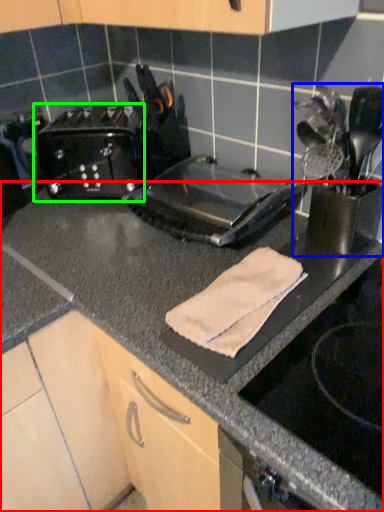
Question: Which object is positioned closest to countertop (highlighted by a red box)? Select from appliance (highlighted by a blue box) and toaster (highlighted by a green box).

Choices:
 (A) appliance
 (B) toaster

Answer: (A)